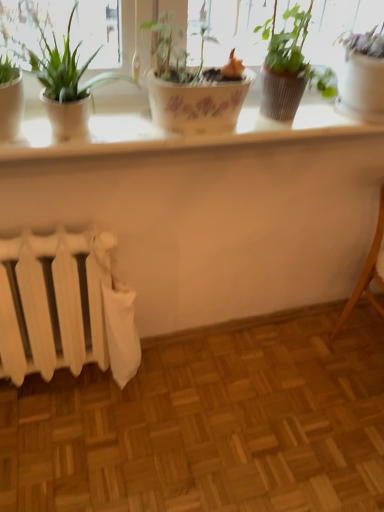
Question: Can you confirm if green matte plant at left, placed as the 3th houseplant when sorted from right to left, is bigger than green matte pot at upper center, the 3th houseplant viewed from the left?

Choices:
 (A) yes
 (B) no

Answer: (A)

Question: From a real-world perspective, is green matte plant at left, placed as the 3th houseplant when sorted from right to left, beneath green matte pot at upper center, which is counted as the second houseplant, starting from the right?

Choices:
 (A) no
 (B) yes

Answer: (B)

Question: From a real-world perspective, is green matte plant at left, placed as the 3th houseplant when sorted from right to left, physically above green matte pot at upper center, which is counted as the second houseplant, starting from the right?

Choices:
 (A) no
 (B) yes

Answer: (A)

Question: Can you confirm if green matte plant at left, placed as the 3th houseplant when sorted from right to left, is positioned to the left of green matte pot at upper center, the 3th houseplant viewed from the left?

Choices:
 (A) yes
 (B) no

Answer: (A)

Question: Considering the relative sizes of green matte plant at left, placed as the 3th houseplant when sorted from right to left, and green matte pot at upper center, which is counted as the second houseplant, starting from the right, in the image provided, is green matte plant at left, placed as the 3th houseplant when sorted from right to left, taller than green matte pot at upper center, which is counted as the second houseplant, starting from the right,?

Choices:
 (A) no
 (B) yes

Answer: (A)

Question: From the image's perspective, is green matte plant at left, the 2th houseplant from the left, under green matte pot at upper center, which is counted as the second houseplant, starting from the right?

Choices:
 (A) no
 (B) yes

Answer: (B)

Question: Is white glossy pot at upper right, marked as the first houseplant in a right-to-left arrangement, thinner than green matte plant at left, placed as the 3th houseplant when sorted from right to left?

Choices:
 (A) yes
 (B) no

Answer: (B)

Question: Is white glossy pot at upper right, marked as the first houseplant in a right-to-left arrangement, positioned behind green matte plant at left, placed as the 3th houseplant when sorted from right to left?

Choices:
 (A) yes
 (B) no

Answer: (A)

Question: Does white glossy pot at upper right, the fourth houseplant when ordered from left to right, lie in front of green matte plant at left, placed as the 3th houseplant when sorted from right to left?

Choices:
 (A) yes
 (B) no

Answer: (B)

Question: From a real-world perspective, is white glossy pot at upper right, marked as the first houseplant in a right-to-left arrangement, below green matte plant at left, placed as the 3th houseplant when sorted from right to left?

Choices:
 (A) no
 (B) yes

Answer: (B)

Question: Does white glossy pot at upper right, the fourth houseplant when ordered from left to right, touch green matte plant at left, placed as the 3th houseplant when sorted from right to left?

Choices:
 (A) yes
 (B) no

Answer: (B)

Question: From the image's perspective, is white glossy pot at upper right, marked as the first houseplant in a right-to-left arrangement, under green matte plant at left, placed as the 3th houseplant when sorted from right to left?

Choices:
 (A) no
 (B) yes

Answer: (A)

Question: Is green matte pot at upper center, which is counted as the second houseplant, starting from the right, outside of light brown wooden chair at lower right?

Choices:
 (A) no
 (B) yes

Answer: (B)